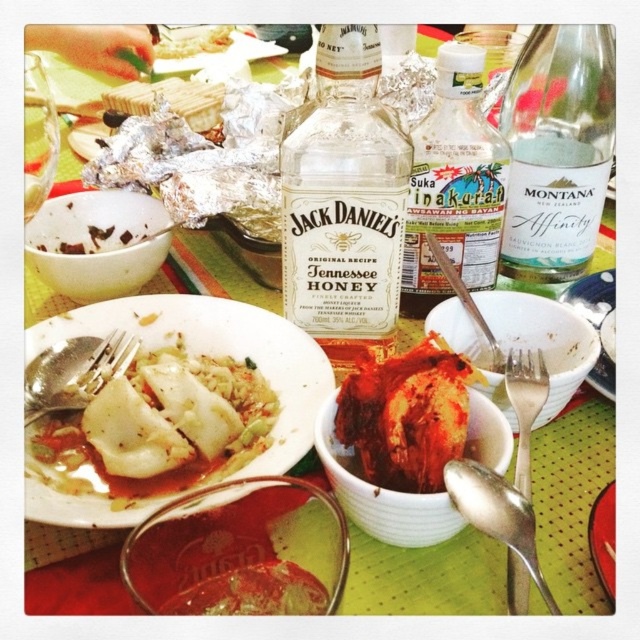
You are at a picnic table and want to grab the translucent glass bottle at center to pour some drink into your cup. However, you need to reach over the white matte plate at center. Based on their positions, which object is closer to your right hand?

The white matte plate at center is to the right of the translucent glass bottle at center, so the white matte plate at center is closer to your right hand.

You are at a picnic and want to grab the translucent glass bottle at center to pour some drink into your cup. However, there is a white matte plate at center in the way. Can you reach the bottle without moving the plate?

The translucent glass bottle at center is in front of the white matte plate at center, so you can reach it without moving the plate.